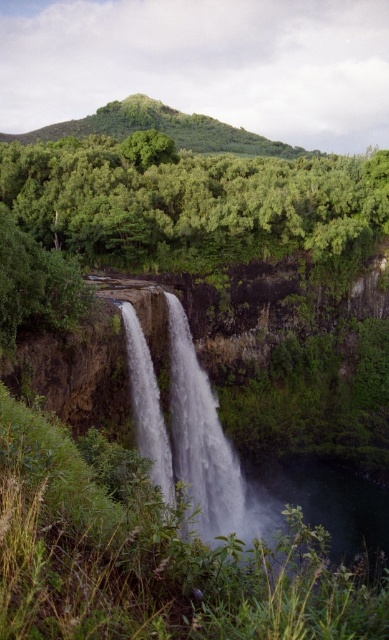
Looking at this image, you are standing at the edge of the cliff overlooking the waterfall. There is a point marked at coordinates (185, 429) in the scene. What does this point most likely represent?

The point at (185, 429) corresponds to the white frothy water at center, which is part of the waterfall cascading down the rocky cliff.

You are standing at the base of the waterfall and looking upward. There is a point marked at coordinates [192,200]. What object or feature is located at this point in the scene?

The point at coordinates [192,200] corresponds to green leafy trees at upper center.